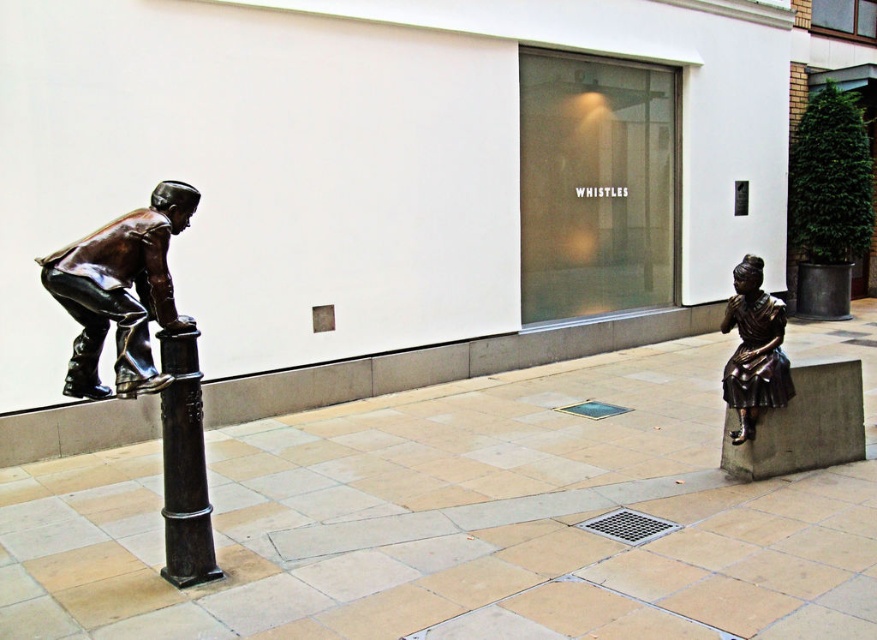
Question: Is bronze statue at left further to camera compared to bronze textured pole at left?

Choices:
 (A) no
 (B) yes

Answer: (A)

Question: Which is farther from the bronze statue at lower right?

Choices:
 (A) bronze textured pole at left
 (B) bronze statue at left

Answer: (B)

Question: Is bronze statue at left in front of bronze statue at lower right?

Choices:
 (A) yes
 (B) no

Answer: (A)

Question: Is bronze textured pole at left to the right of bronze statue at lower right from the viewer's perspective?

Choices:
 (A) yes
 (B) no

Answer: (B)

Question: Which of the following is the farthest from the observer?

Choices:
 (A) bronze statue at lower right
 (B) bronze textured pole at left
 (C) bronze statue at left

Answer: (A)

Question: Among these objects, which one is nearest to the camera?

Choices:
 (A) bronze statue at lower right
 (B) bronze statue at left

Answer: (B)